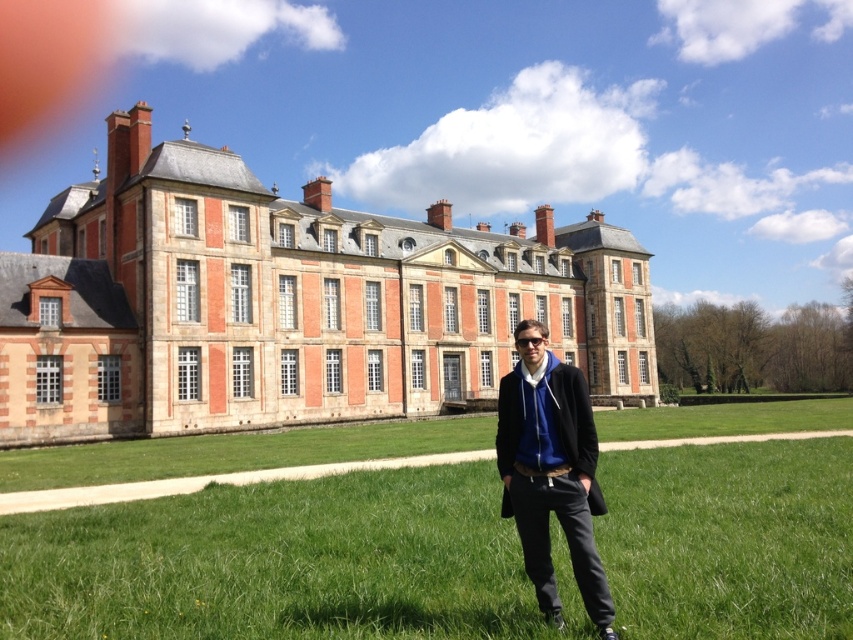
How far apart are brick stone palace at center and blue fleece jacket at center?

A distance of 19.80 meters exists between brick stone palace at center and blue fleece jacket at center.

Who is positioned more to the left, brick stone palace at center or blue fleece jacket at center?

brick stone palace at center is more to the left.

Which is in front, point (549, 273) or point (553, 468)?

Positioned in front is point (553, 468).

At what (x,y) coordinates should I click in order to perform the action: click on brick stone palace at center. Please return your answer as a coordinate pair (x, y). The width and height of the screenshot is (853, 640). Looking at the image, I should click on (287, 301).

Which is behind, point (556, 541) or point (524, 342)?

Positioned behind is point (556, 541).

Consider the image. Which is more to the right, green grass at center or blue fleece jacket at center?

From the viewer's perspective, blue fleece jacket at center appears more on the right side.

Which is behind, point (22, 516) or point (567, 545)?

Positioned behind is point (22, 516).

Identify the location of green grass at center. (276, 563).

Which is in front, point (613, 372) or point (154, 561)?

Positioned in front is point (154, 561).

Is brick stone palace at center above green grass at center?

Correct, brick stone palace at center is located above green grass at center.

Which is behind, point (18, 291) or point (715, 460)?

Point (18, 291)

This screenshot has height=640, width=853. What are the coordinates of `brick stone palace at center` in the screenshot? It's located at (287, 301).